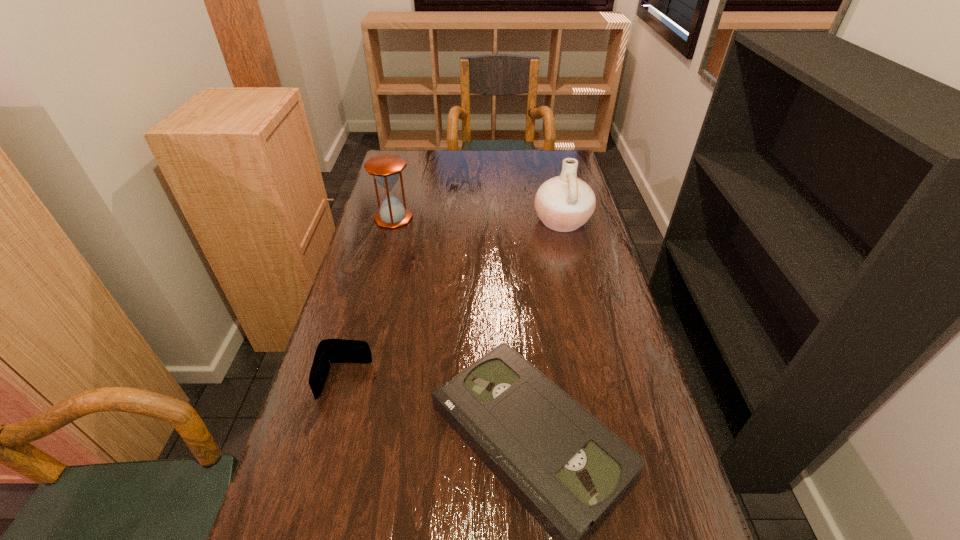
The height and width of the screenshot is (540, 960). Find the location of `object that is the nearest to the pottery`. object that is the nearest to the pottery is located at coordinates (386, 169).

Where is `blank area in the image that satisfies the following two spatial constraints: 1. to pour from the handle of the pottery; 2. on the outer surface of the second shortest object`? This screenshot has width=960, height=540. blank area in the image that satisfies the following two spatial constraints: 1. to pour from the handle of the pottery; 2. on the outer surface of the second shortest object is located at coordinates (601, 381).